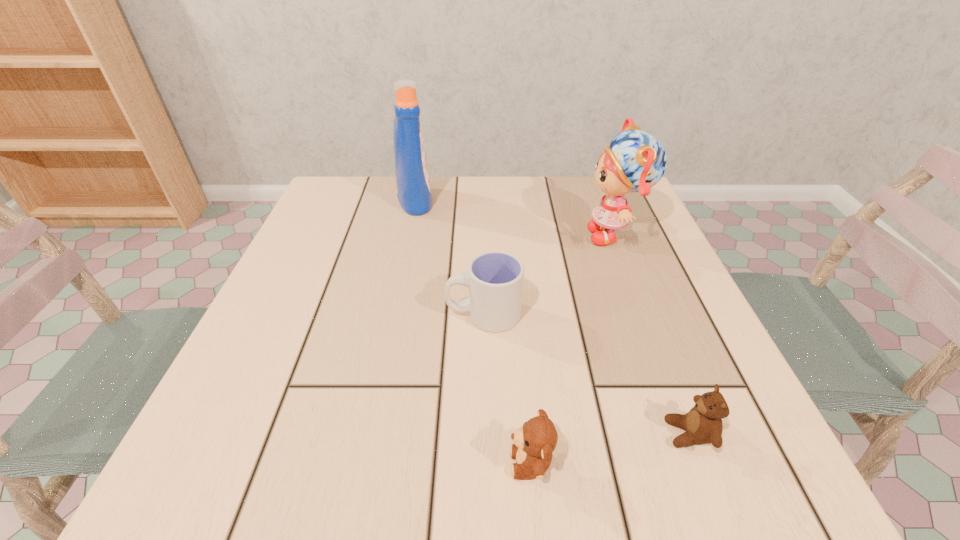
Find the location of a particular element. the tallest object is located at coordinates (412, 177).

This screenshot has width=960, height=540. Identify the location of the leftmost object. (412, 177).

The image size is (960, 540). I want to click on doll, so click(x=635, y=161).

Image resolution: width=960 pixels, height=540 pixels. I want to click on the third farthest object, so click(x=495, y=279).

You are a GUI agent. You are given a task and a screenshot of the screen. Output one action in this format:
    pyautogui.click(x=<x>, y=<y>)
    Task: Click on the right teddy bear
    
    Given the screenshot: What is the action you would take?
    pyautogui.click(x=703, y=424)

At what (x,y) coordinates should I click in order to perform the action: click on the left teddy bear. Please return your answer as a coordinate pair (x, y). The image size is (960, 540). Looking at the image, I should click on (534, 443).

You are a GUI agent. You are given a task and a screenshot of the screen. Output one action in this format:
    pyautogui.click(x=<x>, y=<y>)
    Task: Click on the free location located on the label of the detergent
    The image size is (960, 540).
    Given the screenshot: What is the action you would take?
    pyautogui.click(x=491, y=200)

I want to click on vacant space located 0.260m on the face of the doll, so click(x=466, y=235).

Image resolution: width=960 pixels, height=540 pixels. Identify the location of vacant space located 0.060m on the face of the doll. (557, 235).

Locate an element on the screen. vacant region located on the face of the doll is located at coordinates (447, 235).